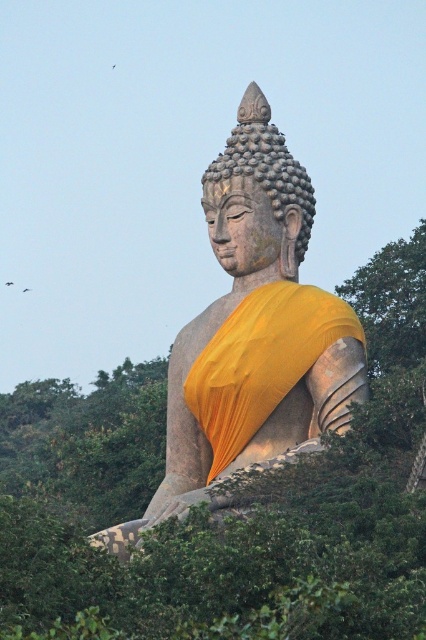
Does green leafy tree at center appear under matte stone buddha head at center?

Yes.

Is green leafy tree at center further to camera compared to matte stone buddha head at center?

No, it is not.

Is point (423, 360) positioned before point (230, 154)?

No, it is not.

The height and width of the screenshot is (640, 426). Find the location of `green leafy tree at center`. green leafy tree at center is located at coordinates (204, 515).

Between stone statue at center and matte stone buddha head at center, which one has more height?

stone statue at center

Which is behind, point (157, 500) or point (261, 140)?

Point (261, 140)

In order to click on stone statue at center in this screenshot , I will do `click(253, 332)`.

Locate an element on the screen. The width and height of the screenshot is (426, 640). stone statue at center is located at coordinates (253, 332).

Does green leafy tree at center come in front of stone statue at center?

Yes, it is.

Does point (25, 614) come in front of point (181, 384)?

That is True.

Who is more forward, (238,534) or (270,365)?

Point (238,534) is more forward.

You are a GUI agent. You are given a task and a screenshot of the screen. Output one action in this format:
    pyautogui.click(x=<x>, y=<y>)
    Task: Click on the green leafy tree at center
    The width and height of the screenshot is (426, 640).
    Given the screenshot: What is the action you would take?
    pyautogui.click(x=204, y=515)